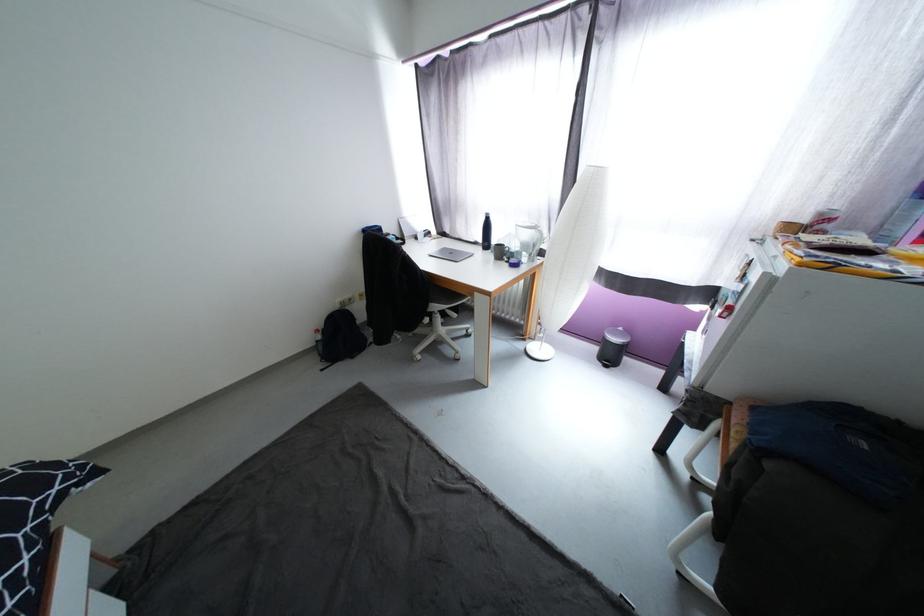
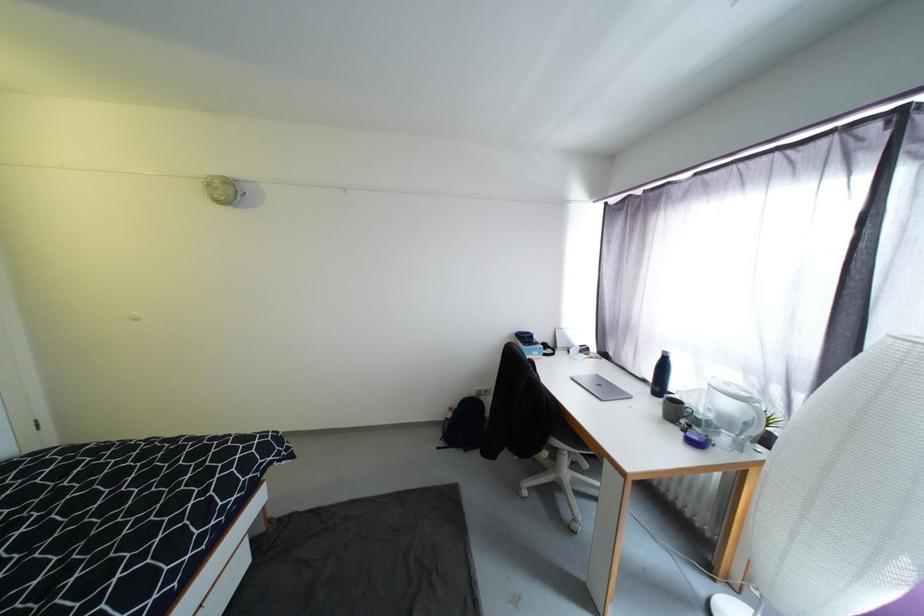
The point at (506,254) is marked in the first image. Where is the corresponding point in the second image?

(683, 413)